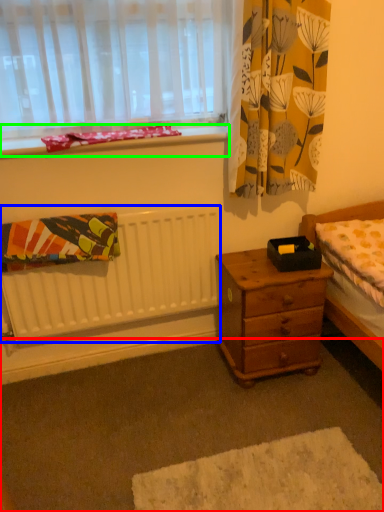
Question: Which object is positioned closest to plain (highlighted by a red box)? Select from radiator (highlighted by a blue box) and window sill (highlighted by a green box).

Choices:
 (A) radiator
 (B) window sill

Answer: (A)